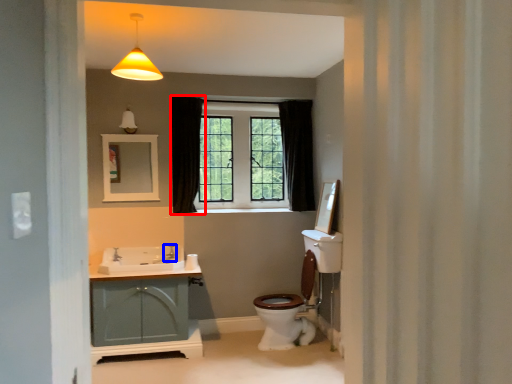
Question: Which of the following is the closest to the observer, curtain (highlighted by a red box) or faucet (highlighted by a blue box)?

Choices:
 (A) curtain
 (B) faucet

Answer: (B)